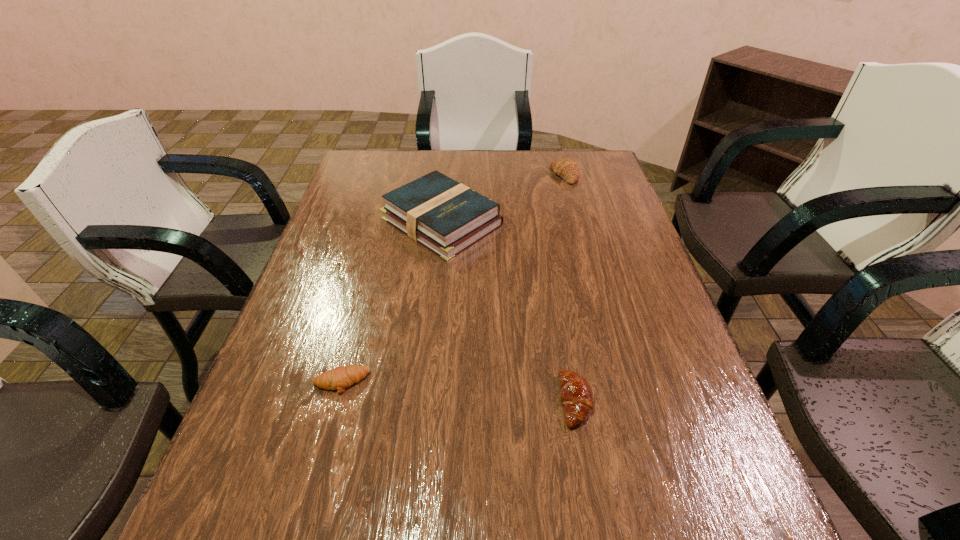
Identify the location of free space located on the left of the second tallest crescent roll. (428, 401).

Image resolution: width=960 pixels, height=540 pixels. Identify the location of free spot located 0.190m on the back of the shortest crescent roll. (362, 304).

Where is `object present at the far edge`? object present at the far edge is located at coordinates (566, 168).

Find the location of a particular element. The image size is (960, 540). hardback book located at the left edge is located at coordinates (445, 216).

You are a GUI agent. You are given a task and a screenshot of the screen. Output one action in this format:
    pyautogui.click(x=<x>, y=<y>)
    Task: Click on the crescent roll at the left edge
    This screenshot has height=540, width=960.
    Given the screenshot: What is the action you would take?
    pyautogui.click(x=339, y=378)

The height and width of the screenshot is (540, 960). Identify the location of object that is at the right edge. coord(566,168).

The height and width of the screenshot is (540, 960). I want to click on object that is positioned at the far right corner, so click(566, 168).

Identify the location of vacant area at the far edge of the desktop. Image resolution: width=960 pixels, height=540 pixels. (429, 156).

This screenshot has height=540, width=960. I want to click on vacant space at the left edge of the desktop, so click(367, 227).

The height and width of the screenshot is (540, 960). I want to click on vacant point at the right edge, so tap(645, 329).